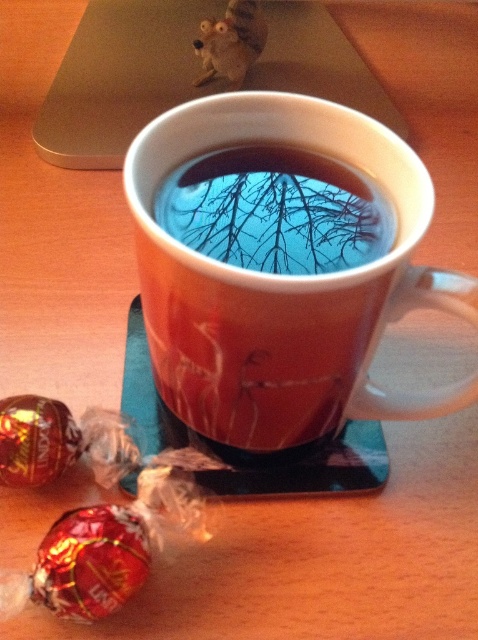
You are organizing items on a desk and want to place the silver metallic laptop at upper center and the transparent glass tea at center. Based on their sizes, which item should you place first to ensure stability?

The silver metallic laptop at upper center is taller than the transparent glass tea at center. Therefore, you should place the transparent glass tea at center first to provide a stable base for the laptop.

You are a child trying to grab both candies without moving your hand. Can you reach both the shiny metallic lollipop at lower left and the shiny foil wrapped chocolate at lower left at the same time if your hand can cover 4 inches?

The distance between the shiny metallic lollipop at lower left and the shiny foil wrapped chocolate at lower left is 3.61 inches, which is less than 4 inches. Therefore, you can reach both candies with your hand.

You are organizing a desk and want to place the silver metallic laptop at upper center and the transparent glass tea at center. Which object should you place first if you want to ensure there is enough space for both?

The silver metallic laptop at upper center might be wider than transparent glass tea at center, so you should place the silver metallic laptop at upper center first to ensure there is enough space for both.